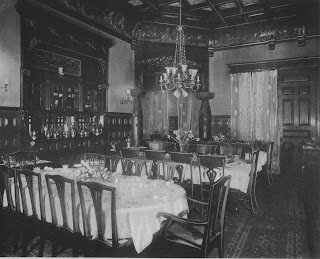
Locate an element on the screen. The height and width of the screenshot is (259, 320). floor is located at coordinates (240, 232).